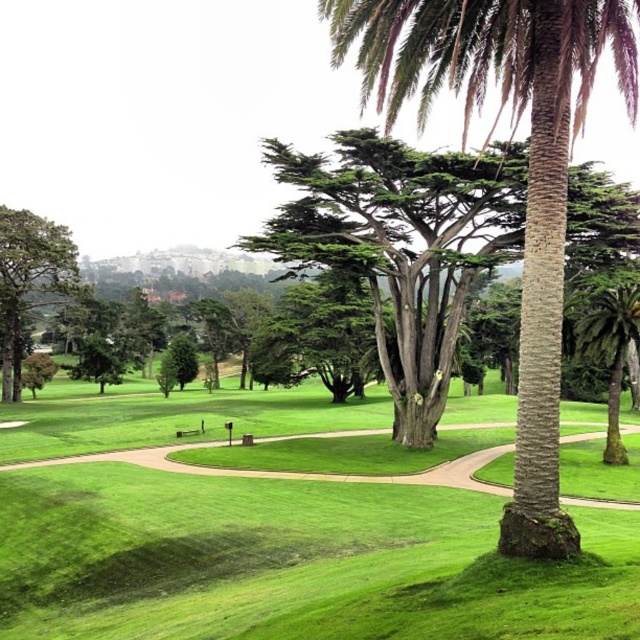
Question: Can you confirm if green grass at center is bigger than green textured palm tree at center?

Choices:
 (A) yes
 (B) no

Answer: (B)

Question: Which object is the farthest from the green grass at center?

Choices:
 (A) green textured palm tree at center
 (B) green mossy palm tree at right
 (C) green matte tree at left

Answer: (C)

Question: Where is green matte tree at left located in relation to green mossy palm tree at right in the image?

Choices:
 (A) below
 (B) above

Answer: (B)

Question: Is green textured palm tree at center smaller than green matte tree at left?

Choices:
 (A) no
 (B) yes

Answer: (A)

Question: Among these points, which one is nearest to the camera?

Choices:
 (A) (481, 68)
 (B) (614, 364)
 (C) (65, 232)

Answer: (A)

Question: Estimate the real-world distances between objects in this image. Which object is closer to the green mossy palm tree at right?

Choices:
 (A) green textured palm tree at center
 (B) green grass at center
 (C) green matte tree at left

Answer: (A)